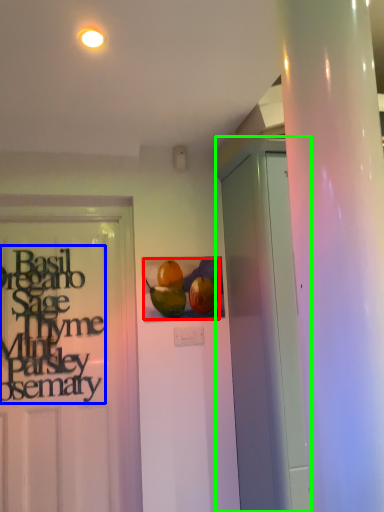
Question: Which is nearer to the fruit (highlighted by a red box)? lettering (highlighted by a blue box) or garage door (highlighted by a green box).

Choices:
 (A) lettering
 (B) garage door

Answer: (B)